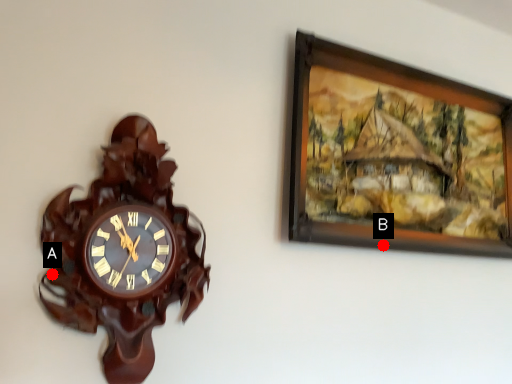
Question: Two points are circled on the image, labeled by A and B beside each circle. Which of the following is the closest to the observer?

Choices:
 (A) A is closer
 (B) B is closer

Answer: (A)